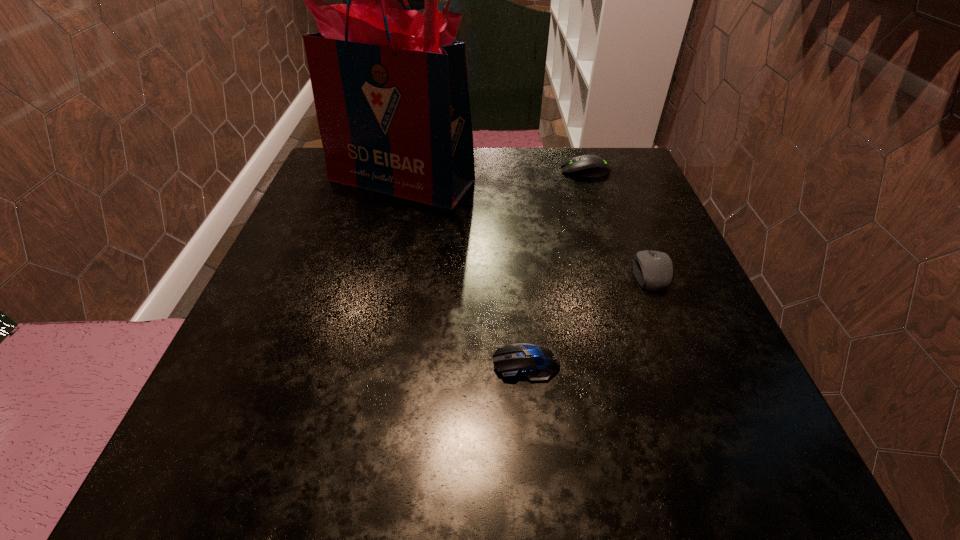
This screenshot has height=540, width=960. Find the location of `vacant space situated 0.180m on the left of the second nearest computer mouse`. vacant space situated 0.180m on the left of the second nearest computer mouse is located at coordinates (533, 273).

Find the location of a particular element. free space located on the button side of the nearest object is located at coordinates (x=317, y=363).

Where is `vacant area located 0.080m on the button side of the nearest object`? Image resolution: width=960 pixels, height=540 pixels. vacant area located 0.080m on the button side of the nearest object is located at coordinates (439, 363).

The width and height of the screenshot is (960, 540). What are the coordinates of `vacant space located on the button side of the nearest object` in the screenshot? It's located at (243, 363).

In order to click on grocery bag located in the far edge section of the desktop in this screenshot , I will do `click(390, 87)`.

You are a GUI agent. You are given a task and a screenshot of the screen. Output one action in this format:
    pyautogui.click(x=<x>, y=<y>)
    Task: Click on the computer mouse located at the far edge
    The height and width of the screenshot is (540, 960).
    Given the screenshot: What is the action you would take?
    pyautogui.click(x=587, y=166)

Locate an element on the screen. The width and height of the screenshot is (960, 540). object present at the left edge is located at coordinates (390, 87).

You are a GUI agent. You are given a task and a screenshot of the screen. Output one action in this format:
    pyautogui.click(x=<x>, y=<y>)
    Task: Click on the object present at the far left corner
    
    Given the screenshot: What is the action you would take?
    pyautogui.click(x=390, y=87)

Locate an element on the screen. The width and height of the screenshot is (960, 540). object present at the far right corner is located at coordinates (587, 166).

I want to click on vacant space at the far edge of the desktop, so click(x=544, y=186).